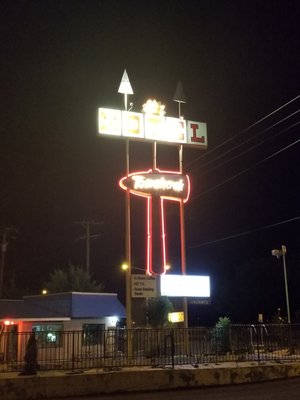
I want to click on windows, so click(52, 328), click(92, 326).